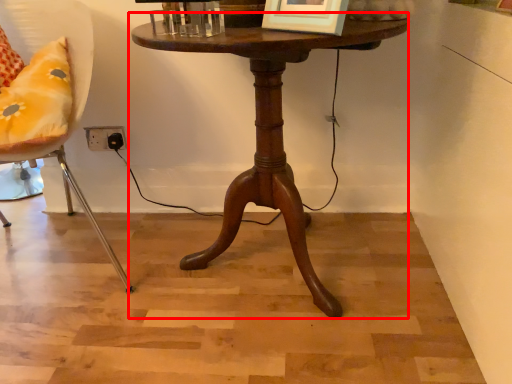
Question: Considering the relative positions of table (annotated by the red box) and chair in the image provided, where is table (annotated by the red box) located with respect to the staircase?

Choices:
 (A) left
 (B) right

Answer: (B)